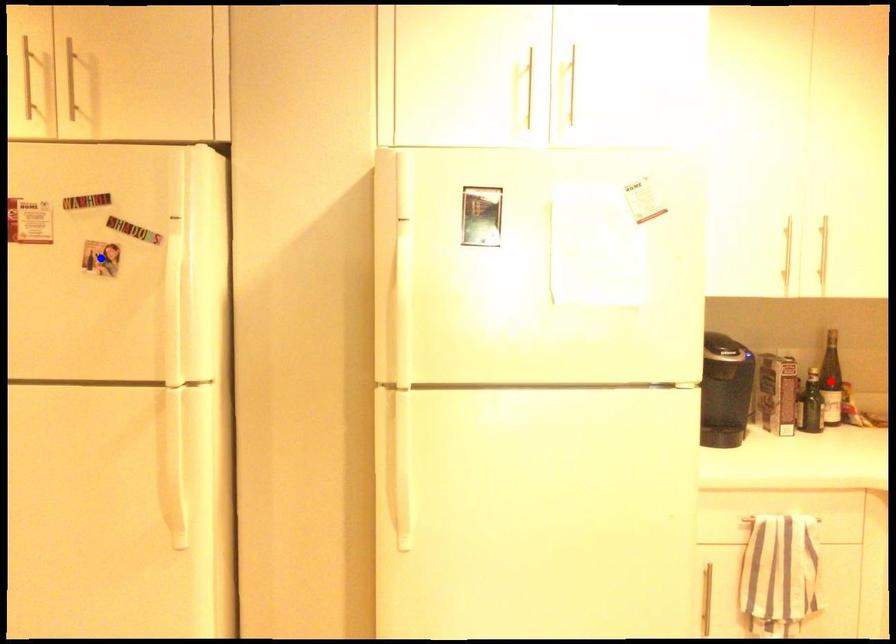
Question: Which of the two points in the image is closer to the camera?

Choices:
 (A) Blue point is closer.
 (B) Red point is closer.

Answer: (A)